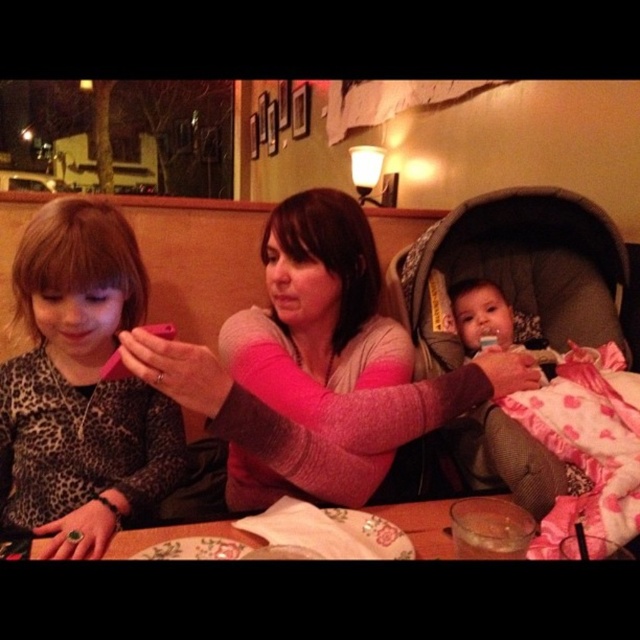
Question: Is pink sweater at center closer to the viewer compared to dark gray fabric baby carriage at right?

Choices:
 (A) yes
 (B) no

Answer: (B)

Question: Which object appears farthest from the camera in this image?

Choices:
 (A) dark gray fabric baby carriage at right
 (B) leopard print sweater at left
 (C) pink sweater at center

Answer: (B)

Question: Can you confirm if pink sweater at center is positioned below dark gray fabric baby carriage at right?

Choices:
 (A) yes
 (B) no

Answer: (A)

Question: Is dark gray fabric baby carriage at right to the left of leopard print sweater at left from the viewer's perspective?

Choices:
 (A) yes
 (B) no

Answer: (B)

Question: Which object appears farthest from the camera in this image?

Choices:
 (A) pink sweater at center
 (B) leopard print sweater at left

Answer: (B)

Question: Estimate the real-world distances between objects in this image. Which object is farther from the pink sweater at center?

Choices:
 (A) leopard print sweater at left
 (B) dark gray fabric baby carriage at right

Answer: (A)